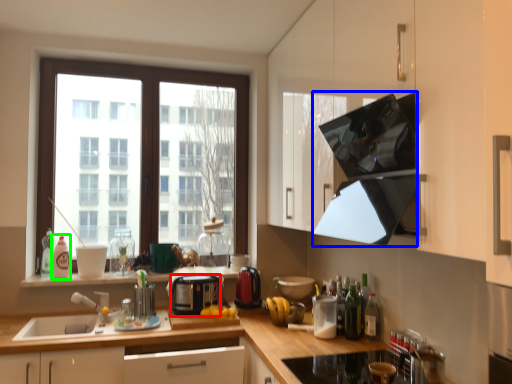
Question: Which is nearer to the appliance (highlighted by a red box)? exhaust hood (highlighted by a blue box) or bottle (highlighted by a green box).

Choices:
 (A) exhaust hood
 (B) bottle

Answer: (B)